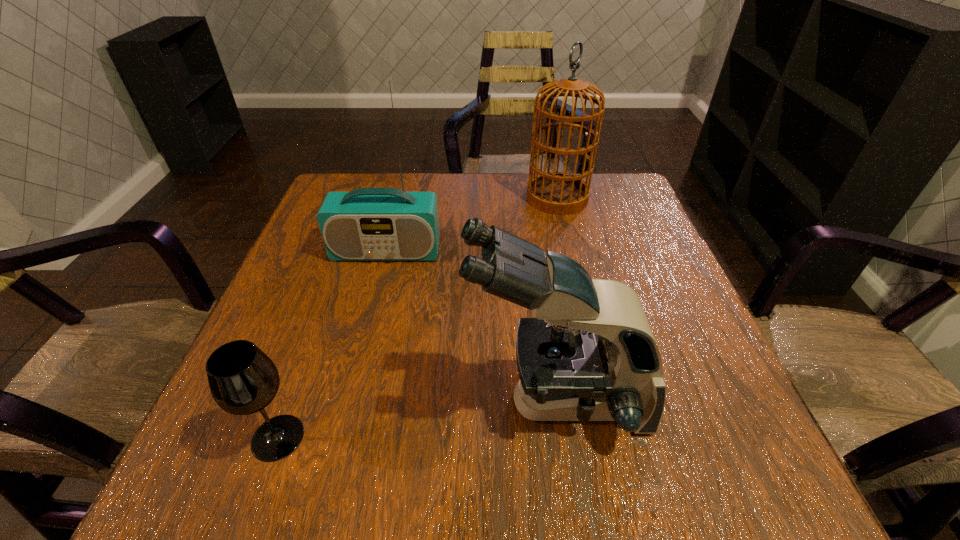
Where is `free space between the microscope and the shortest object`? free space between the microscope and the shortest object is located at coordinates (417, 419).

Where is `vacant area that lies between the microscope and the second farthest object`? vacant area that lies between the microscope and the second farthest object is located at coordinates (471, 326).

This screenshot has width=960, height=540. I want to click on vacant area that lies between the wineglass and the microscope, so (417, 419).

Locate which object ranks in proximity to the wineglass. Please provide its 2D coordinates. Your answer should be formatted as a tuple, i.e. [(x, y)], where the tuple contains the x and y coordinates of a point satisfying the conditions above.

[(589, 355)]

Identify the location of object that stands as the second closest to the microscope. The image size is (960, 540). (366, 224).

The height and width of the screenshot is (540, 960). I want to click on vacant area in the image that satisfies the following two spatial constraints: 1. on the front side of the farthest object; 2. through the eyepieces of the microscope, so click(606, 400).

Find the location of a particular element. This screenshot has height=540, width=960. vacant region that satisfies the following two spatial constraints: 1. on the back side of the birdcage; 2. on the left side of the wineglass is located at coordinates (365, 198).